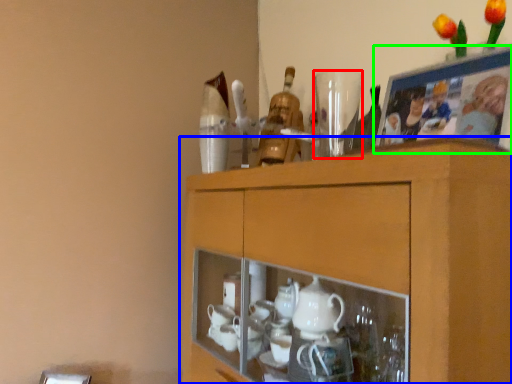
Question: Which object is positioned closest to tableware (highlighted by a red box)? Select from cabinetry (highlighted by a blue box) and picture frame (highlighted by a green box).

Choices:
 (A) cabinetry
 (B) picture frame

Answer: (B)